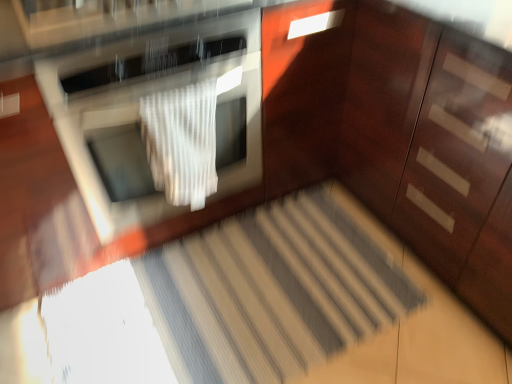
Question: Looking at the image, does glossy wood dresser at right seem bigger or smaller compared to satin silver oven at center?

Choices:
 (A) big
 (B) small

Answer: (A)

Question: In terms of height, does glossy wood dresser at right look taller or shorter compared to satin silver oven at center?

Choices:
 (A) tall
 (B) short

Answer: (A)

Question: Based on their relative distances, which object is farther from the glossy wood dresser at right?

Choices:
 (A) satin silver oven at center
 (B) striped carpet at center
 (C) white textured blanket at center

Answer: (C)

Question: Estimate the real-world distances between objects in this image. Which object is closer to the white textured blanket at center?

Choices:
 (A) glossy wood dresser at right
 (B) satin silver oven at center
 (C) striped carpet at center

Answer: (B)